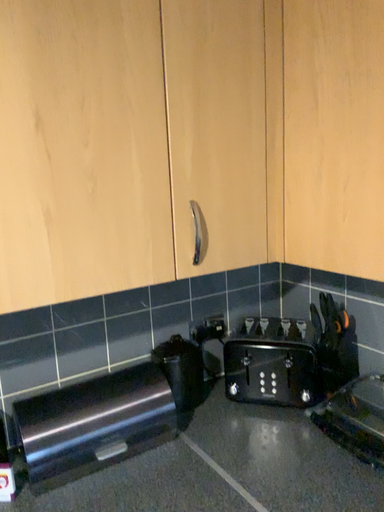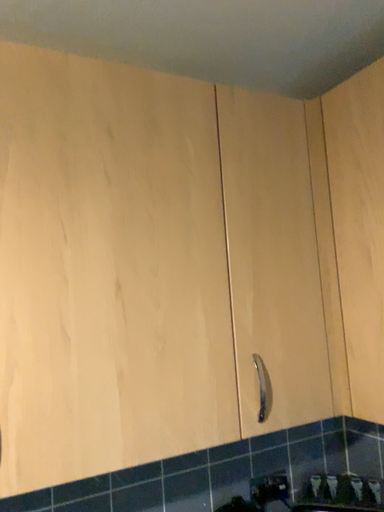
Question: Which way did the camera rotate in the video?

Choices:
 (A) rotated upward
 (B) rotated downward

Answer: (A)